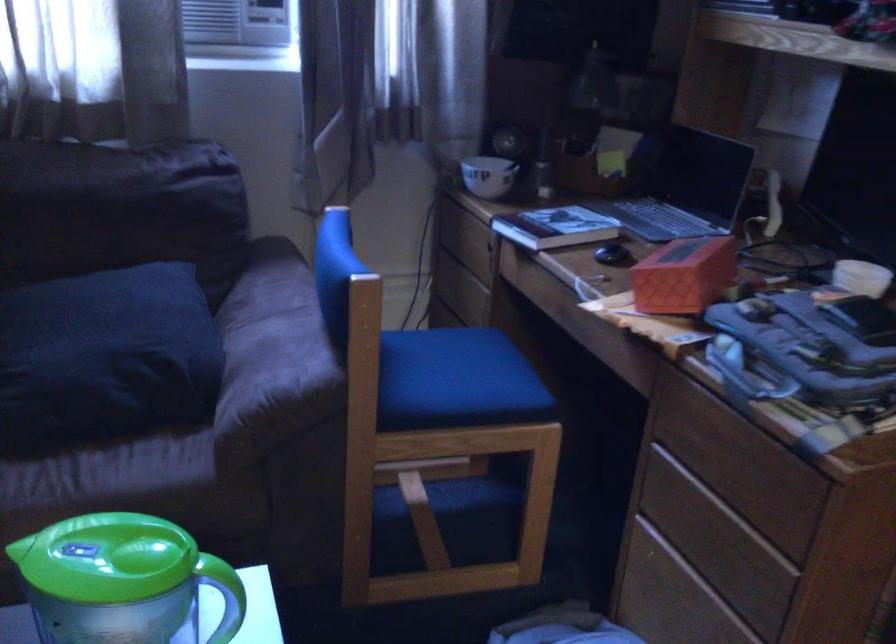
Find where to rest the sofa armrest. Please return your answer as a coordinate pair (x, y).

(274, 335)